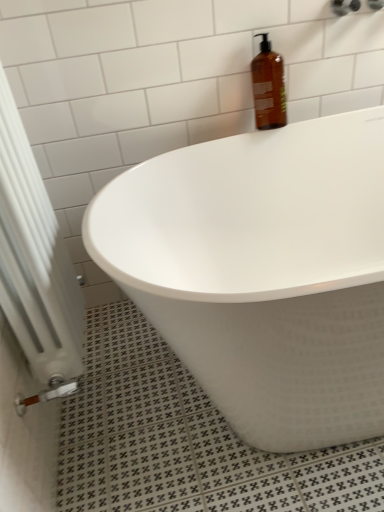
Question: Would you consider white glossy bathtub at upper center to be distant from brown glass bottle at upper center?

Choices:
 (A) yes
 (B) no

Answer: (B)

Question: Would you say white glossy bathtub at upper center is outside brown glass bottle at upper center?

Choices:
 (A) yes
 (B) no

Answer: (A)

Question: From the image's perspective, does white glossy bathtub at upper center appear lower than brown glass bottle at upper center?

Choices:
 (A) yes
 (B) no

Answer: (A)

Question: Does white glossy bathtub at upper center have a lesser width compared to brown glass bottle at upper center?

Choices:
 (A) no
 (B) yes

Answer: (A)

Question: Considering the relative sizes of white glossy bathtub at upper center and brown glass bottle at upper center in the image provided, is white glossy bathtub at upper center shorter than brown glass bottle at upper center?

Choices:
 (A) yes
 (B) no

Answer: (B)

Question: Is white glossy bathtub at upper center facing towards brown glass bottle at upper center?

Choices:
 (A) no
 (B) yes

Answer: (A)

Question: Does white metallic radiator at lower left have a lesser width compared to brown glass bottle at upper center?

Choices:
 (A) no
 (B) yes

Answer: (A)

Question: Considering the relative positions of white metallic radiator at lower left and brown glass bottle at upper center in the image provided, is white metallic radiator at lower left to the left of brown glass bottle at upper center from the viewer's perspective?

Choices:
 (A) yes
 (B) no

Answer: (A)

Question: Can you confirm if white metallic radiator at lower left is taller than brown glass bottle at upper center?

Choices:
 (A) no
 (B) yes

Answer: (B)

Question: From the image's perspective, does white metallic radiator at lower left appear lower than brown glass bottle at upper center?

Choices:
 (A) no
 (B) yes

Answer: (B)

Question: Is white metallic radiator at lower left further to the viewer compared to brown glass bottle at upper center?

Choices:
 (A) yes
 (B) no

Answer: (B)

Question: Are white metallic radiator at lower left and brown glass bottle at upper center beside each other?

Choices:
 (A) no
 (B) yes

Answer: (A)

Question: Is there a large distance between brown glass bottle at upper center and white glossy bathtub at upper center?

Choices:
 (A) no
 (B) yes

Answer: (A)